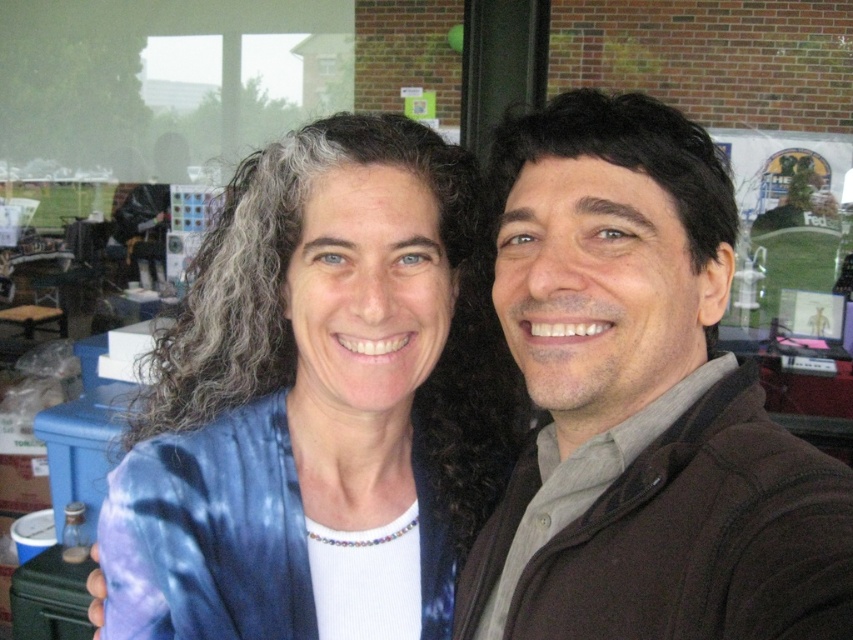
Question: Can you confirm if brown fuzzy jacket at right is bigger than tie-dye fabric at center?

Choices:
 (A) yes
 (B) no

Answer: (B)

Question: Is brown fuzzy jacket at right below tie-dye fabric at center?

Choices:
 (A) yes
 (B) no

Answer: (B)

Question: Which of the following is the farthest from the observer?

Choices:
 (A) (833, 621)
 (B) (461, 209)

Answer: (B)

Question: In this image, where is brown fuzzy jacket at right located relative to tie-dye fabric at center?

Choices:
 (A) left
 (B) right

Answer: (B)